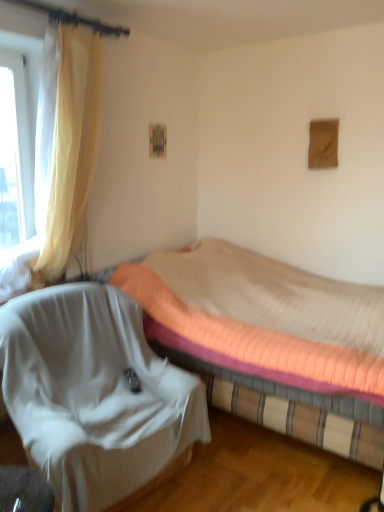
I want to click on pink quilted mattress at center, so click(x=269, y=341).

Which object is further away from the camera, transparent glass window at left or yellow sheer curtain at left?

transparent glass window at left is further from the camera.

Which is in front, point (11, 104) or point (78, 173)?

Point (78, 173)

Could you tell me if transparent glass window at left is facing yellow sheer curtain at left?

Yes, transparent glass window at left is aimed at yellow sheer curtain at left.

From a real-world perspective, which is physically above, transparent glass window at left or yellow sheer curtain at left?

From a 3D spatial view, transparent glass window at left is above.

Is the surface of pink quilted mattress at center in direct contact with yellow sheer curtain at left?

No, pink quilted mattress at center is not next to yellow sheer curtain at left.

Between pink quilted mattress at center and yellow sheer curtain at left, which one has more height?

yellow sheer curtain at left is taller.

Is pink quilted mattress at center thinner than yellow sheer curtain at left?

Incorrect, the width of pink quilted mattress at center is not less than that of yellow sheer curtain at left.

Considering the points (364, 291) and (80, 164), which point is in front, point (364, 291) or point (80, 164)?

The point (80, 164) is in front.

Which object is positioned more to the right, transparent glass window at left or white fabric chair at lower left?

white fabric chair at lower left.

Is point (25, 196) positioned before point (65, 392)?

No, it is behind (65, 392).

Considering the sizes of objects transparent glass window at left and white fabric chair at lower left in the image provided, who is taller, transparent glass window at left or white fabric chair at lower left?

Standing taller between the two is transparent glass window at left.

Is transparent glass window at left thinner than pink quilted mattress at center?

Yes.

Which is more to the right, transparent glass window at left or pink quilted mattress at center?

pink quilted mattress at center.

From the image's perspective, is transparent glass window at left under pink quilted mattress at center?

Incorrect, from the image's perspective, transparent glass window at left is higher than pink quilted mattress at center.

Considering the sizes of objects pink quilted mattress at center and white fabric chair at lower left in the image provided, who is taller, pink quilted mattress at center or white fabric chair at lower left?

pink quilted mattress at center is taller.

Can you see pink quilted mattress at center touching white fabric chair at lower left?

No, pink quilted mattress at center is not making contact with white fabric chair at lower left.

Relative to white fabric chair at lower left, is pink quilted mattress at center in front or behind?

Visually, pink quilted mattress at center is located behind white fabric chair at lower left.

The image size is (384, 512). What are the coordinates of `chair lying on the left of pink quilted mattress at center` in the screenshot? It's located at (94, 393).

From the image's perspective, would you say white fabric chair at lower left is shown under pink quilted mattress at center?

Yes, from the image's perspective, white fabric chair at lower left is below pink quilted mattress at center.

Is white fabric chair at lower left turned away from pink quilted mattress at center?

No, pink quilted mattress at center is not at the back of white fabric chair at lower left.

In terms of width, does white fabric chair at lower left look wider or thinner when compared to pink quilted mattress at center?

white fabric chair at lower left is thinner than pink quilted mattress at center.

Would you say white fabric chair at lower left is a long distance from pink quilted mattress at center?

Actually, white fabric chair at lower left and pink quilted mattress at center are a little close together.

Considering the positions of objects pink quilted mattress at center and transparent glass window at left in the image provided, who is behind, pink quilted mattress at center or transparent glass window at left?

transparent glass window at left is further from the camera.

Would you say pink quilted mattress at center contains transparent glass window at left?

No, transparent glass window at left is located outside of pink quilted mattress at center.

Is point (230, 270) positioned before point (1, 62)?

No, it is behind (1, 62).

From a real-world perspective, is pink quilted mattress at center above or below transparent glass window at left?

In terms of real-world spatial position, pink quilted mattress at center is below transparent glass window at left.

Locate an element on the screen. This screenshot has height=512, width=384. window that is above the yellow sheer curtain at left (from the image's perspective) is located at coordinates (14, 154).

Identify the location of bed below the yellow sheer curtain at left (from the image's perspective). (269, 341).

Looking at the image, which one is located further to yellow sheer curtain at left, transparent glass window at left or white fabric chair at lower left?

Among the two, white fabric chair at lower left is located further to yellow sheer curtain at left.

Considering their positions, is transparent glass window at left positioned further to white fabric chair at lower left than yellow sheer curtain at left?

Based on the image, transparent glass window at left appears to be further to white fabric chair at lower left.

Estimate the real-world distances between objects in this image. Which object is further from transparent glass window at left, white fabric chair at lower left or yellow sheer curtain at left?

white fabric chair at lower left is further to transparent glass window at left.

Estimate the real-world distances between objects in this image. Which object is further from yellow sheer curtain at left, pink quilted mattress at center or white fabric chair at lower left?

pink quilted mattress at center.

Which object lies nearer to the anchor point yellow sheer curtain at left, white fabric chair at lower left or pink quilted mattress at center?

white fabric chair at lower left is closer to yellow sheer curtain at left.

Estimate the real-world distances between objects in this image. Which object is closer to pink quilted mattress at center, white fabric chair at lower left or yellow sheer curtain at left?

The object closer to pink quilted mattress at center is white fabric chair at lower left.

Considering their positions, is pink quilted mattress at center positioned closer to transparent glass window at left than yellow sheer curtain at left?

Among the two, yellow sheer curtain at left is located nearer to transparent glass window at left.

Estimate the real-world distances between objects in this image. Which object is closer to transparent glass window at left, white fabric chair at lower left or pink quilted mattress at center?

white fabric chair at lower left.

Identify the location of chair located between transparent glass window at left and pink quilted mattress at center in the left-right direction. (94, 393).

The width and height of the screenshot is (384, 512). Find the location of `curtain between transparent glass window at left and white fabric chair at lower left in the up-down direction`. curtain between transparent glass window at left and white fabric chair at lower left in the up-down direction is located at coordinates (68, 149).

I want to click on curtain between transparent glass window at left and pink quilted mattress at center in the horizontal direction, so click(68, 149).

Where is `chair between yellow sheer curtain at left and pink quilted mattress at center from left to right`? chair between yellow sheer curtain at left and pink quilted mattress at center from left to right is located at coordinates (94, 393).